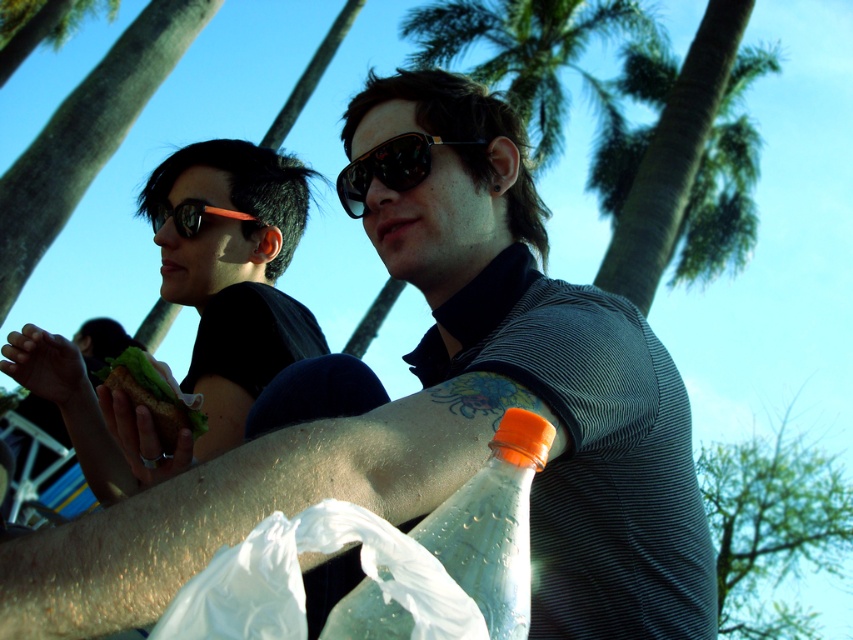
Question: Can you confirm if green leafy palm tree at upper right is positioned to the left of green leafy palm tree at upper left?

Choices:
 (A) yes
 (B) no

Answer: (B)

Question: Does transparent plastic bag at lower center come in front of matte orange sunglasses at upper left?

Choices:
 (A) yes
 (B) no

Answer: (A)

Question: Can you confirm if matte black sunglasses at upper left is thinner than sunglasses at center?

Choices:
 (A) yes
 (B) no

Answer: (B)

Question: Which of these objects is positioned closest to the transparent plastic bag at lower center?

Choices:
 (A) matte black sunglasses at upper left
 (B) green leafy palm tree at upper center

Answer: (A)

Question: Which point is closer to the camera taking this photo?

Choices:
 (A) (518, 480)
 (B) (274, 538)

Answer: (B)

Question: Which object appears farthest from the camera in this image?

Choices:
 (A) green leafy sandwich at left
 (B) green leafy palm tree at upper center
 (C) sunglasses at center
 (D) matte orange sunglasses at upper left

Answer: (B)